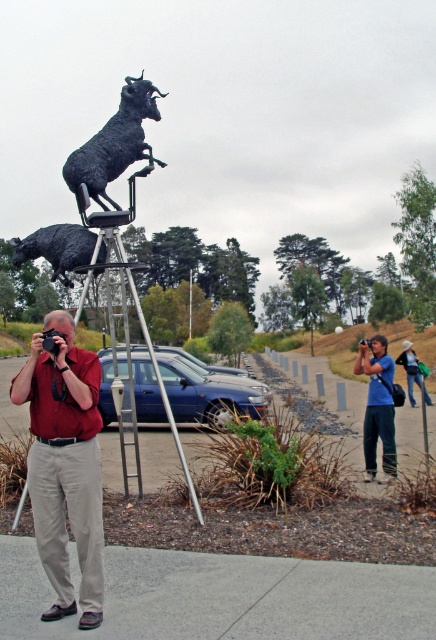
Question: Where is blue cotton shirt at center located in relation to black matte bull at center in the image?

Choices:
 (A) right
 (B) left

Answer: (A)

Question: Is bronze statue at center further to the viewer compared to blue cotton shirt at center?

Choices:
 (A) no
 (B) yes

Answer: (A)

Question: Which of the following is the closest to the observer?

Choices:
 (A) (88, 499)
 (B) (391, 360)
 (C) (139, 145)
 (D) (88, 262)

Answer: (A)

Question: Can you confirm if bronze statue at center is wider than blue cotton shirt at center?

Choices:
 (A) yes
 (B) no

Answer: (A)

Question: Which object is farther from the camera taking this photo?

Choices:
 (A) black matte bull at center
 (B) bronze statue at center

Answer: (A)

Question: Estimate the real-world distances between objects in this image. Which object is closer to the black matte bull at center?

Choices:
 (A) khaki pants at center
 (B) blue cotton shirt at center

Answer: (A)